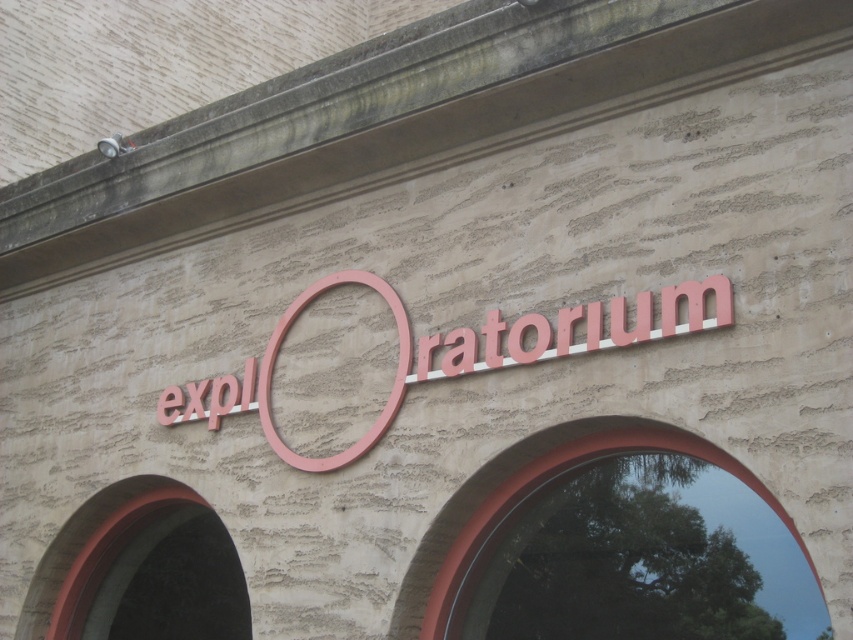
You are standing in front of the building and notice the smooth red arch at lower left and the smooth glass window at center. Which object is positioned to the left of the other?

The smooth red arch at lower left is positioned to the left of the smooth glass window at center.

You are standing in front of the building facade. You want to take a photo of the smooth glass window at center without the smooth red arch at lower left blocking it. Is this possible?

The smooth glass window at center is behind the smooth red arch at lower left, so it is blocked by the arch. Therefore, you cannot take a photo of the smooth glass window at center without the smooth red arch at lower left blocking it.

You are standing at the entrance of the building and want to read the pink matte sign at center. Considering the distance, can you read the text clearly without moving closer?

The pink matte sign at center is 97.44 feet away from the viewer. At this distance, it may be difficult to read the text clearly without moving closer.